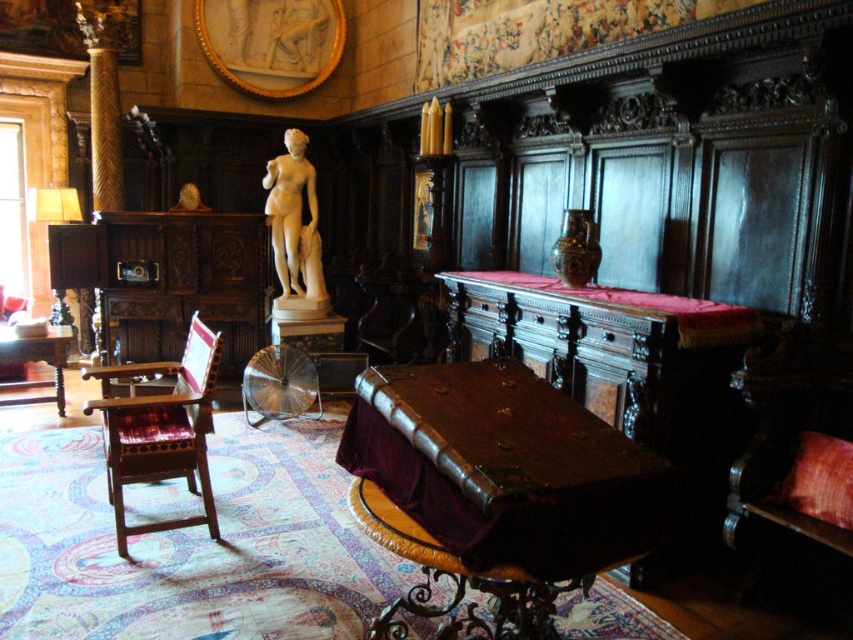
You are a tour guide leading a group through this historical house. You need to move a 1.5 meter wide decorative item from the wooden table at left to the area near the white marble statue at center. Is there enough space between them to move the item without tilting it sideways?

The distance between the white marble statue at center and the wooden table at left is 1.88 meters. Since the decorative item is 1.5 meters wide, there is sufficient space to move it straight without tilting, as 1.88 meters is greater than 1.5 meters.